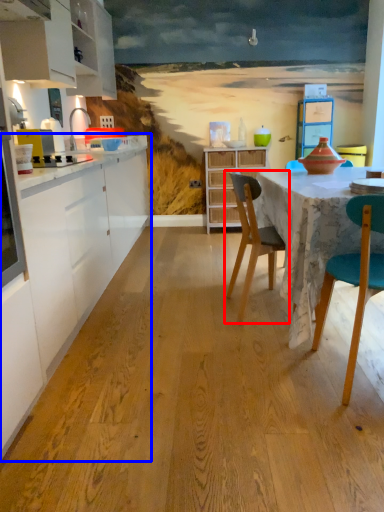
Question: Which object is closer to the camera taking this photo, chair (highlighted by a red box) or countertop (highlighted by a blue box)?

Choices:
 (A) chair
 (B) countertop

Answer: (B)